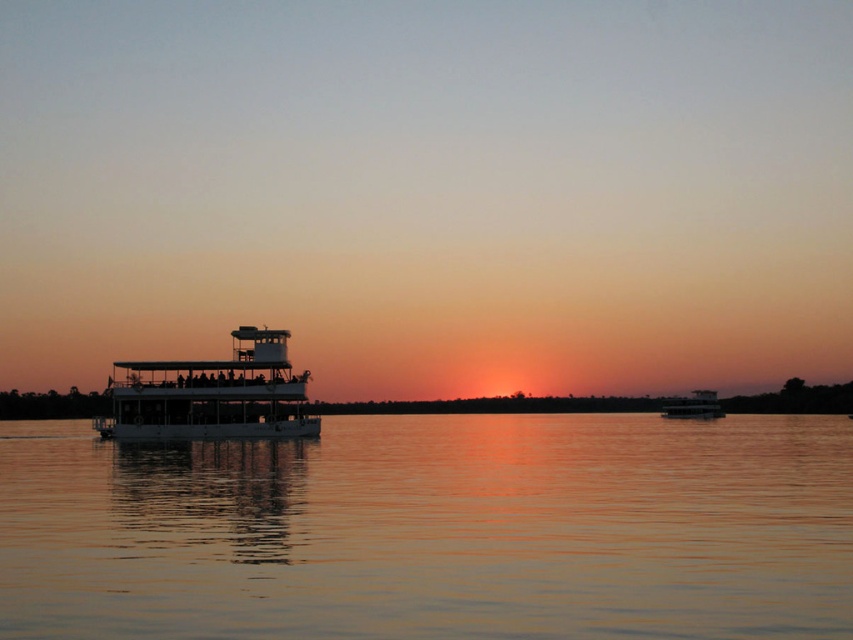
Question: Among these points, which one is nearest to the camera?

Choices:
 (A) (709, 397)
 (B) (274, 428)

Answer: (B)

Question: Which object appears closest to the camera in this image?

Choices:
 (A) white glossy boat at center
 (B) smooth water at center
 (C) white matte boat at center

Answer: (B)

Question: Does smooth water at center appear over white glossy boat at center?

Choices:
 (A) yes
 (B) no

Answer: (A)

Question: Among these objects, which one is nearest to the camera?

Choices:
 (A) smooth water at center
 (B) white glossy boat at center
 (C) white matte boat at center

Answer: (A)

Question: Is smooth water at center smaller than white matte boat at center?

Choices:
 (A) yes
 (B) no

Answer: (B)

Question: Observing the image, what is the correct spatial positioning of white matte boat at center in reference to white glossy boat at center?

Choices:
 (A) above
 (B) below

Answer: (A)